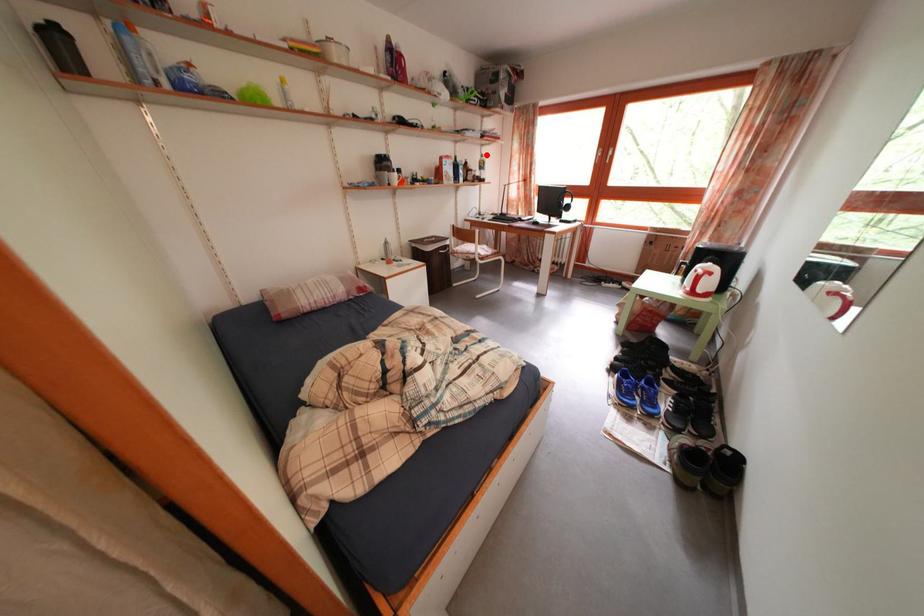
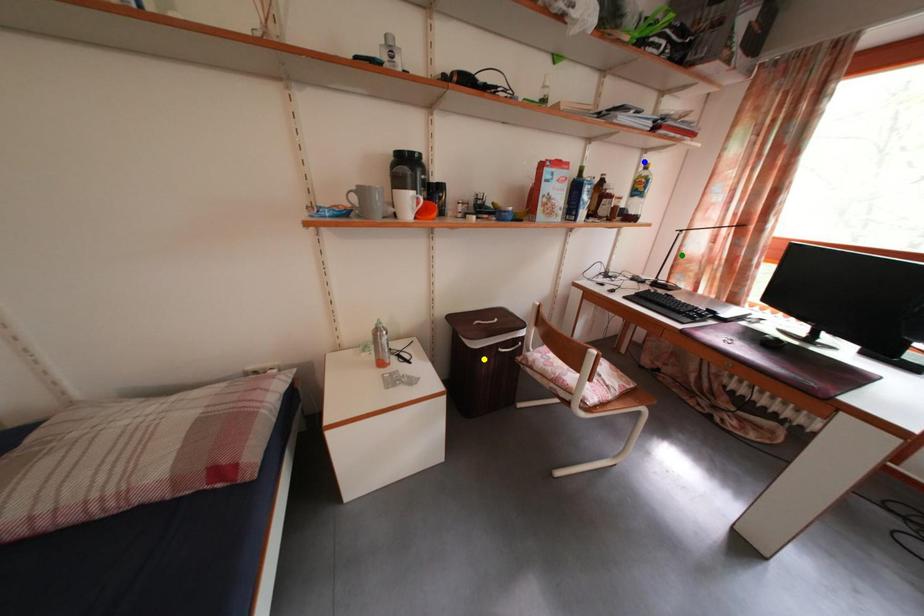
Question: I am providing you with two images of the same scene from different viewpoints. A red point is marked on the first image. You are given multiple points on the second image. Which point in image 2 is actually the same real-world point as the red point in image 1?

Choices:
 (A) blue point
 (B) green point
 (C) yellow point

Answer: (A)